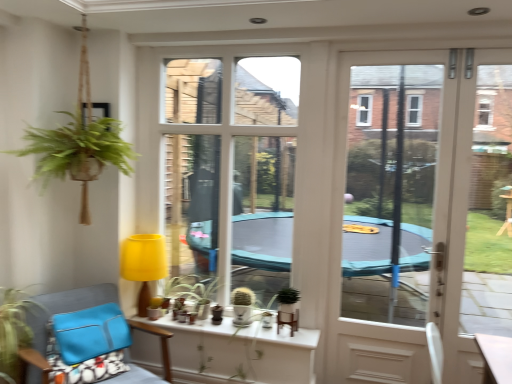
Question: Does matte white cactus at center, which is the first houseplant in right-to-left order, have a lesser height compared to white ceramic pots at center?

Choices:
 (A) no
 (B) yes

Answer: (A)

Question: Considering the relative sizes of matte white cactus at center, which is the first houseplant in right-to-left order, and white ceramic pots at center in the image provided, is matte white cactus at center, which is the first houseplant in right-to-left order, smaller than white ceramic pots at center?

Choices:
 (A) yes
 (B) no

Answer: (A)

Question: Could you tell me if matte white cactus at center, positioned as the first houseplant in back-to-front order, is facing white ceramic pots at center?

Choices:
 (A) yes
 (B) no

Answer: (B)

Question: From the image's perspective, is matte white cactus at center, which is the first houseplant in right-to-left order, on top of white ceramic pots at center?

Choices:
 (A) yes
 (B) no

Answer: (A)

Question: From a real-world perspective, is matte white cactus at center, positioned as the first houseplant in back-to-front order, located beneath white ceramic pots at center?

Choices:
 (A) yes
 (B) no

Answer: (B)

Question: Is matte white cactus at center, positioned as the first houseplant in back-to-front order, closer to the viewer compared to white ceramic pots at center?

Choices:
 (A) no
 (B) yes

Answer: (A)

Question: Can you confirm if green matte plant at lower left, the 2th houseplant viewed from the back, is positioned to the right of transparent plastic window screen at center?

Choices:
 (A) no
 (B) yes

Answer: (A)

Question: Considering the relative positions of green matte plant at lower left, arranged as the 1th houseplant when viewed from the front, and transparent plastic window screen at center in the image provided, is green matte plant at lower left, arranged as the 1th houseplant when viewed from the front, to the left of transparent plastic window screen at center from the viewer's perspective?

Choices:
 (A) yes
 (B) no

Answer: (A)

Question: Can transparent plastic window screen at center be found inside green matte plant at lower left, arranged as the 1th houseplant when viewed from the front?

Choices:
 (A) yes
 (B) no

Answer: (B)

Question: Considering the relative sizes of green matte plant at lower left, the second houseplant viewed from the right, and transparent plastic window screen at center in the image provided, is green matte plant at lower left, the second houseplant viewed from the right, smaller than transparent plastic window screen at center?

Choices:
 (A) yes
 (B) no

Answer: (A)

Question: Is the position of green matte plant at lower left, the second houseplant viewed from the right, less distant than that of transparent plastic window screen at center?

Choices:
 (A) no
 (B) yes

Answer: (B)

Question: From the image's perspective, is green matte plant at lower left, the second houseplant viewed from the right, below transparent plastic window screen at center?

Choices:
 (A) yes
 (B) no

Answer: (A)

Question: Does white glass door at right have a larger size compared to green matte plant at lower left, the 2th houseplant viewed from the back?

Choices:
 (A) no
 (B) yes

Answer: (B)